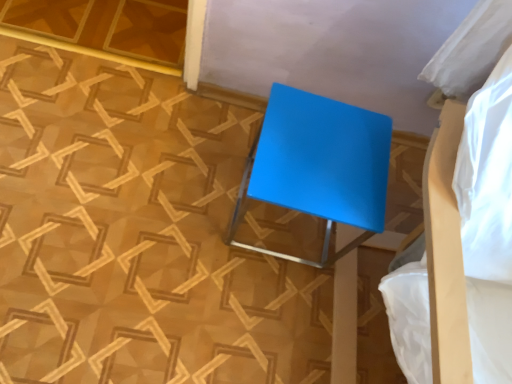
Locate an element on the screen. This screenshot has height=384, width=512. free space to the left of blue glossy stool at center is located at coordinates (201, 172).